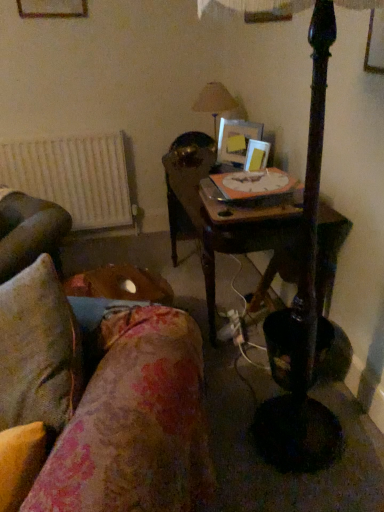
Question: Does white matte radiator at left lie in front of matte beige lampshade at upper center?

Choices:
 (A) yes
 (B) no

Answer: (B)

Question: From a real-world perspective, is white matte radiator at left positioned over matte beige lampshade at upper center based on gravity?

Choices:
 (A) yes
 (B) no

Answer: (B)

Question: Considering the relative positions of white matte radiator at left and matte beige lampshade at upper center in the image provided, is white matte radiator at left to the right of matte beige lampshade at upper center from the viewer's perspective?

Choices:
 (A) yes
 (B) no

Answer: (B)

Question: From a real-world perspective, does white matte radiator at left sit lower than matte beige lampshade at upper center?

Choices:
 (A) yes
 (B) no

Answer: (A)

Question: Is white matte radiator at left outside matte beige lampshade at upper center?

Choices:
 (A) no
 (B) yes

Answer: (B)

Question: Is white matte radiator at left taller or shorter than wooden picture frame at upper left, positioned as the 1th picture frame in top-to-bottom order?

Choices:
 (A) tall
 (B) short

Answer: (A)

Question: Is point (112, 207) closer or farther from the camera than point (64, 11)?

Choices:
 (A) closer
 (B) farther

Answer: (B)

Question: From the image's perspective, is white matte radiator at left above or below wooden picture frame at upper left, which appears as the 1th picture frame when viewed from the left?

Choices:
 (A) above
 (B) below

Answer: (B)

Question: Would you say white matte radiator at left is to the left or to the right of wooden picture frame at upper left, the 3th picture frame ordered from the bottom, in the picture?

Choices:
 (A) right
 (B) left

Answer: (B)

Question: Looking at their shapes, would you say matte wooden picture frame at upper center, acting as the first picture frame starting from the bottom, is wider or thinner than floral fabric couch at lower left?

Choices:
 (A) thin
 (B) wide

Answer: (A)

Question: Is matte wooden picture frame at upper center, acting as the third picture frame starting from the left, spatially inside floral fabric couch at lower left, or outside of it?

Choices:
 (A) inside
 (B) outside

Answer: (B)

Question: Would you say matte wooden picture frame at upper center, acting as the first picture frame starting from the bottom, is to the left or to the right of floral fabric couch at lower left in the picture?

Choices:
 (A) left
 (B) right

Answer: (B)

Question: Based on their sizes in the image, would you say matte wooden picture frame at upper center, arranged as the 1th picture frame when viewed from the right, is bigger or smaller than floral fabric couch at lower left?

Choices:
 (A) big
 (B) small

Answer: (B)

Question: From a real-world perspective, is matte beige lampshade at upper center physically located above or below wooden picture frame at center, which is counted as the 2th picture frame, starting from the top?

Choices:
 (A) below
 (B) above

Answer: (B)

Question: Considering the positions of matte beige lampshade at upper center and wooden picture frame at center, positioned as the 2th picture frame in bottom-to-top order, in the image, is matte beige lampshade at upper center taller or shorter than wooden picture frame at center, positioned as the 2th picture frame in bottom-to-top order,?

Choices:
 (A) tall
 (B) short

Answer: (A)